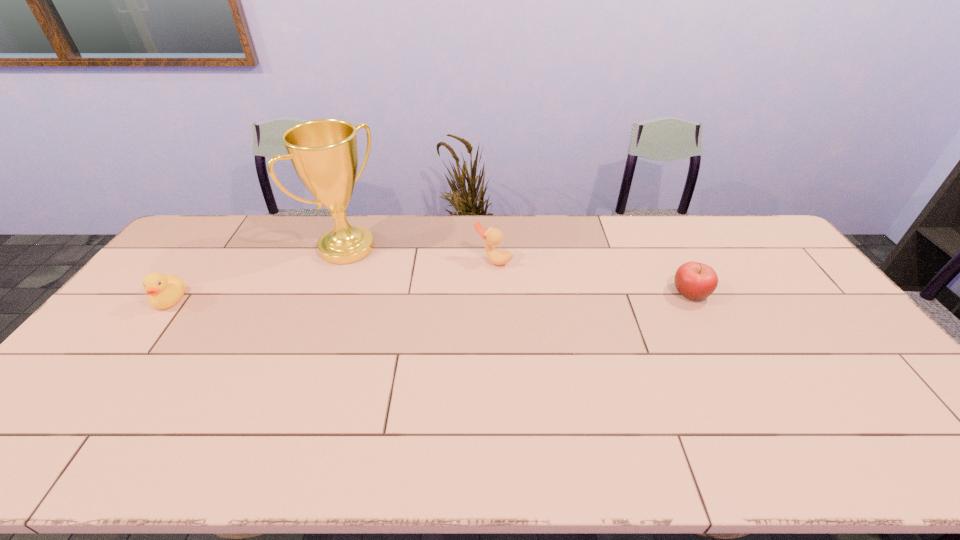
In order to click on free space at the far left corner of the desktop in this screenshot , I will do `click(211, 230)`.

I want to click on free space between the tallest object and the second object from right to left, so click(420, 254).

Identify the location of unoccupied position between the apple and the leftmost object. This screenshot has width=960, height=540. (430, 296).

This screenshot has height=540, width=960. In order to click on empty space that is in between the leftmost object and the tallest object in this screenshot , I will do `click(258, 274)`.

Find the location of a particular element. Image resolution: width=960 pixels, height=540 pixels. free space between the leftmost object and the second object from right to left is located at coordinates (331, 280).

At what (x,y) coordinates should I click in order to perform the action: click on vacant area that lies between the apple and the leftmost object. Please return your answer as a coordinate pair (x, y). Looking at the image, I should click on (430, 296).

Where is `empty space between the apple and the award`? The width and height of the screenshot is (960, 540). empty space between the apple and the award is located at coordinates (518, 271).

Where is `vacant space that's between the apple and the third object from left to right`? This screenshot has height=540, width=960. vacant space that's between the apple and the third object from left to right is located at coordinates (591, 276).

At what (x,y) coordinates should I click in order to perform the action: click on empty space between the second object from left to right and the duckling. Please return your answer as a coordinate pair (x, y). Looking at the image, I should click on 258,274.

Find the location of a particular element. The height and width of the screenshot is (540, 960). unoccupied position between the award and the duckling is located at coordinates (258, 274).